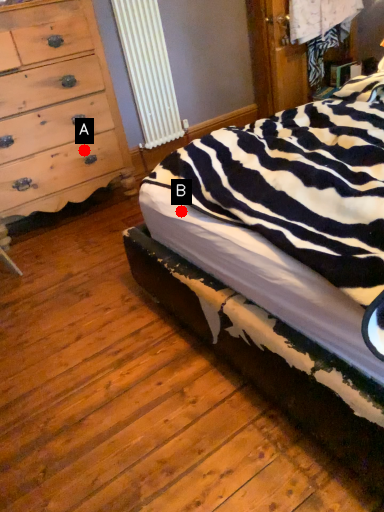
Question: Two points are circled on the image, labeled by A and B beside each circle. Which point appears farthest from the camera in this image?

Choices:
 (A) A is further
 (B) B is further

Answer: (A)